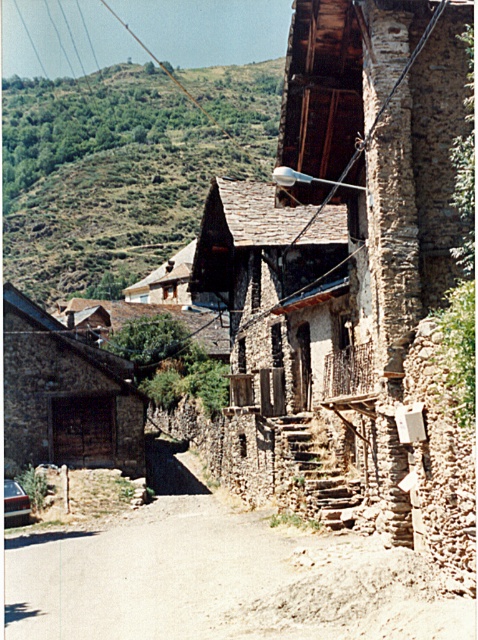
Question: Considering the relative positions of stone textured hut at lower left and metallic silver car at lower left in the image provided, where is stone textured hut at lower left located with respect to metallic silver car at lower left?

Choices:
 (A) right
 (B) left

Answer: (B)

Question: Where is green grassy hillside at upper left located in relation to metallic wire at upper center in the image?

Choices:
 (A) above
 (B) below

Answer: (B)

Question: Which object is the farthest from the green grassy hillside at upper left?

Choices:
 (A) stone textured hut at lower left
 (B) metallic silver car at lower left

Answer: (B)

Question: Among these points, which one is nearest to the camera?

Choices:
 (A) (85, 10)
 (B) (142, 90)
 (C) (14, 493)
 (D) (130, 449)

Answer: (C)

Question: Does green grassy hillside at upper left have a smaller size compared to metallic silver car at lower left?

Choices:
 (A) no
 (B) yes

Answer: (A)

Question: Which of the following is the farthest from the observer?

Choices:
 (A) (40, 289)
 (B) (106, 67)
 (C) (28, 465)

Answer: (B)